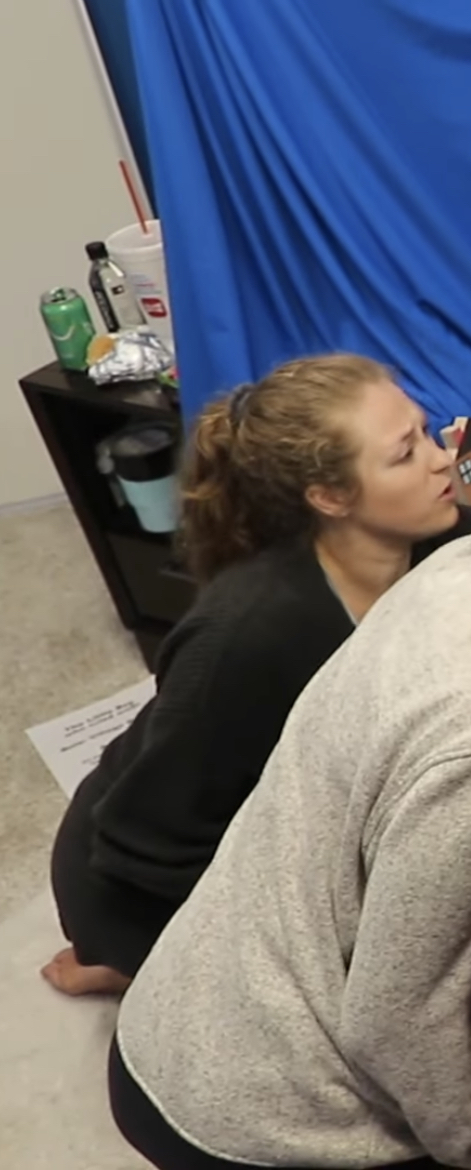
Locate an element on the screen. This screenshot has height=1170, width=471. floor is located at coordinates (61, 639), (34, 1065).